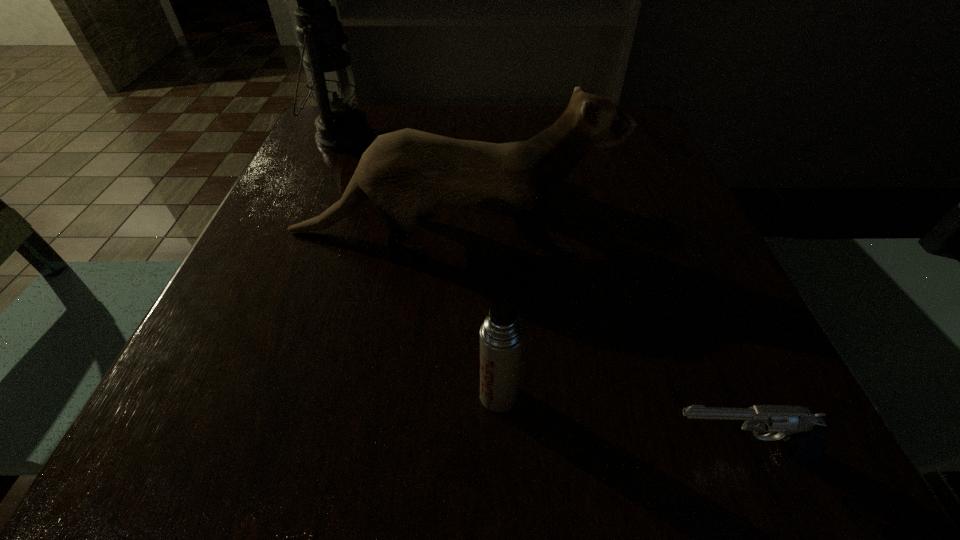
This screenshot has height=540, width=960. Find the location of `unoccupied position between the gun and the thermos bottle`. unoccupied position between the gun and the thermos bottle is located at coordinates tap(617, 423).

Locate an element on the screen. This screenshot has height=540, width=960. free space between the nearest object and the third shortest object is located at coordinates (593, 342).

Image resolution: width=960 pixels, height=540 pixels. I want to click on empty space that is in between the ferret and the nearest object, so click(x=593, y=342).

Where is `free space that is in between the shortest object and the third farthest object`? The width and height of the screenshot is (960, 540). free space that is in between the shortest object and the third farthest object is located at coordinates tap(617, 423).

Identify the location of vacant area that lies between the ferret and the gun. Image resolution: width=960 pixels, height=540 pixels. (593, 342).

Find the location of a particular element. The height and width of the screenshot is (540, 960). free space that is in between the thermos bottle and the tallest object is located at coordinates (420, 266).

Locate which object ranks in proximity to the oil lamp. Please provide its 2D coordinates. Your answer should be formatted as a tuple, i.e. [(x, y)], where the tuple contains the x and y coordinates of a point satisfying the conditions above.

[(406, 173)]

The image size is (960, 540). In order to click on object that is the third closest to the third farthest object in this screenshot , I will do `click(340, 127)`.

The image size is (960, 540). Identify the location of free location that satisfies the following two spatial constraints: 1. on the front side of the thermos bottle; 2. on the left side of the tallest object. (228, 395).

Locate an element on the screen. The image size is (960, 540). vacant area in the image that satisfies the following two spatial constraints: 1. on the back side of the second shortest object; 2. on the face of the second farthest object is located at coordinates (493, 232).